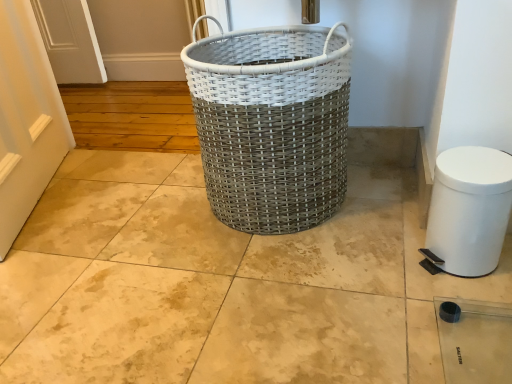
Find the location of a particular element. The width and height of the screenshot is (512, 384). vacant area that is in front of white plastic trash can at lower right is located at coordinates (462, 303).